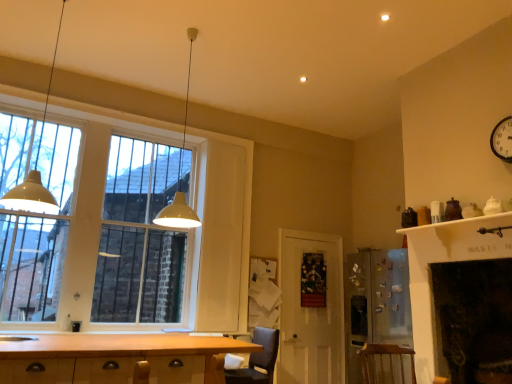
Question: Considering the positions of wooden at lower right, the second armchair viewed from the left, and matte glass window at left in the image, is wooden at lower right, the second armchair viewed from the left, wider or thinner than matte glass window at left?

Choices:
 (A) thin
 (B) wide

Answer: (B)

Question: From the image's perspective, relative to matte glass window at left, is wooden at lower right, the second armchair viewed from the left, above or below?

Choices:
 (A) above
 (B) below

Answer: (B)

Question: Which of these objects is positioned farthest from the white wooden door at center?

Choices:
 (A) white glossy sink at lower left
 (B) matte glass window at left
 (C) white glossy clock at upper right
 (D) wooden cabinet at lower left
 (E) matte yellow pendant light at upper center, the 1th light fixture viewed from the right

Answer: (A)

Question: Which object is the farthest from the wooden at lower right, arranged as the first armchair when viewed from the right?

Choices:
 (A) matte yellow pendant light at upper center, positioned as the 2th light fixture in left-to-right order
 (B) white glossy sink at lower left
 (C) dark gray fabric armchair at lower center, placed as the 1th armchair when sorted from left to right
 (D) matte white pendant lamp at left, which is counted as the 1th light fixture, starting from the left
 (E) white glossy clock at upper right

Answer: (D)